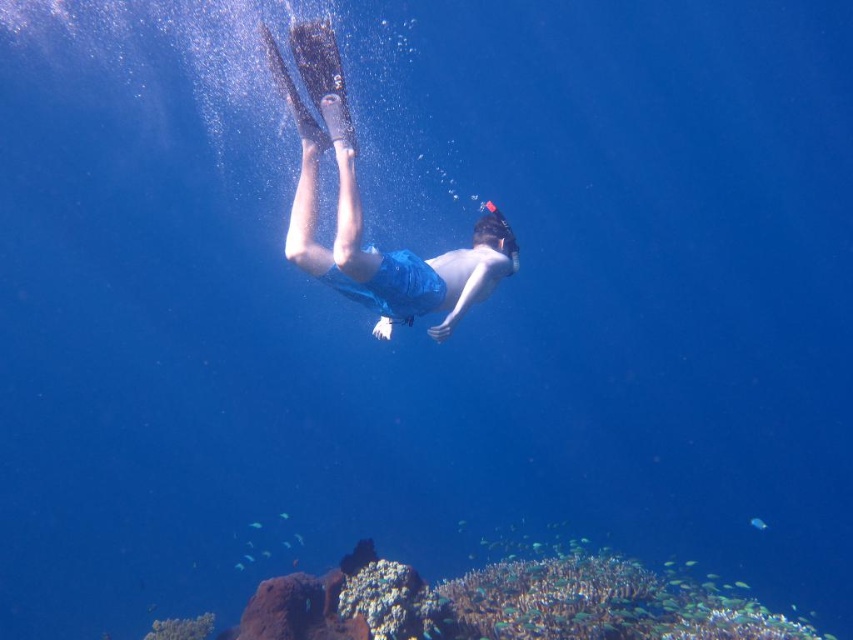
Who is more forward, (x=300, y=616) or (x=489, y=289)?

Point (x=489, y=289) is in front.

Can you confirm if white coral reef at lower center is thinner than blue fabric shorts at center?

Incorrect, white coral reef at lower center's width is not less than blue fabric shorts at center's.

Is point (372, 561) farther from camera compared to point (310, 269)?

Yes, point (372, 561) is behind point (310, 269).

This screenshot has height=640, width=853. Find the location of `white coral reef at lower center`. white coral reef at lower center is located at coordinates (502, 604).